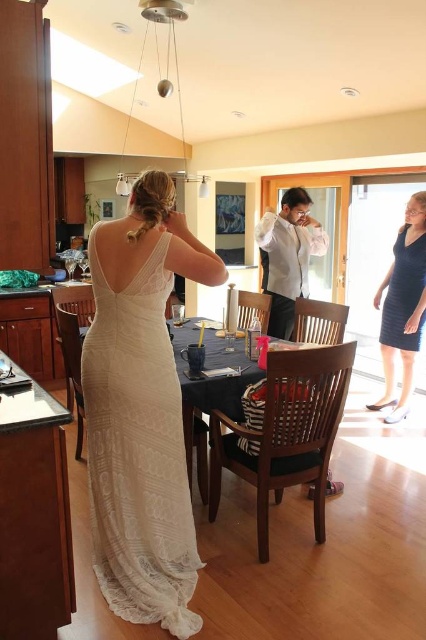
Can you confirm if white lace dress at center is thinner than dark blue textured dress at lower right?

No.

Which is below, white lace dress at center or dark blue textured dress at lower right?

Positioned lower is white lace dress at center.

The width and height of the screenshot is (426, 640). I want to click on white lace dress at center, so click(x=138, y=451).

Find the location of a particular element. white lace dress at center is located at coordinates (138, 451).

Does point (92, 275) lie in front of point (412, 268)?

That is True.

Can you confirm if white lace dress at center is wider than black matte dress at right?

Indeed, white lace dress at center has a greater width compared to black matte dress at right.

This screenshot has height=640, width=426. Describe the element at coordinates (138, 451) in the screenshot. I see `white lace dress at center` at that location.

Where is `white lace dress at center`? white lace dress at center is located at coordinates (138, 451).

The width and height of the screenshot is (426, 640). Describe the element at coordinates (402, 307) in the screenshot. I see `dark blue textured dress at lower right` at that location.

Is point (405, 285) behind point (405, 236)?

No, (405, 285) is in front of (405, 236).

Who is more distant from viewer, (411, 253) or (382, 321)?

The point (382, 321) is more distant.

Locate an element on the screen. The width and height of the screenshot is (426, 640). dark blue textured dress at lower right is located at coordinates (402, 307).